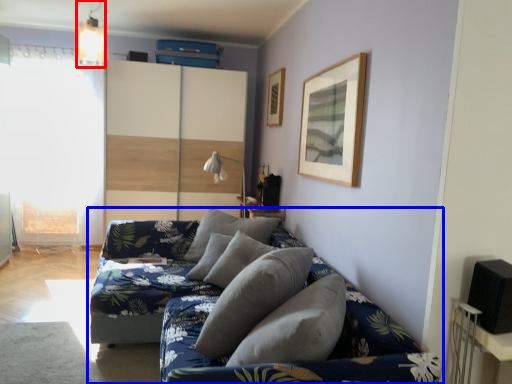
Question: Which object appears closest to the camera in this image, light fixture (highlighted by a red box) or studio couch (highlighted by a blue box)?

Choices:
 (A) light fixture
 (B) studio couch

Answer: (B)